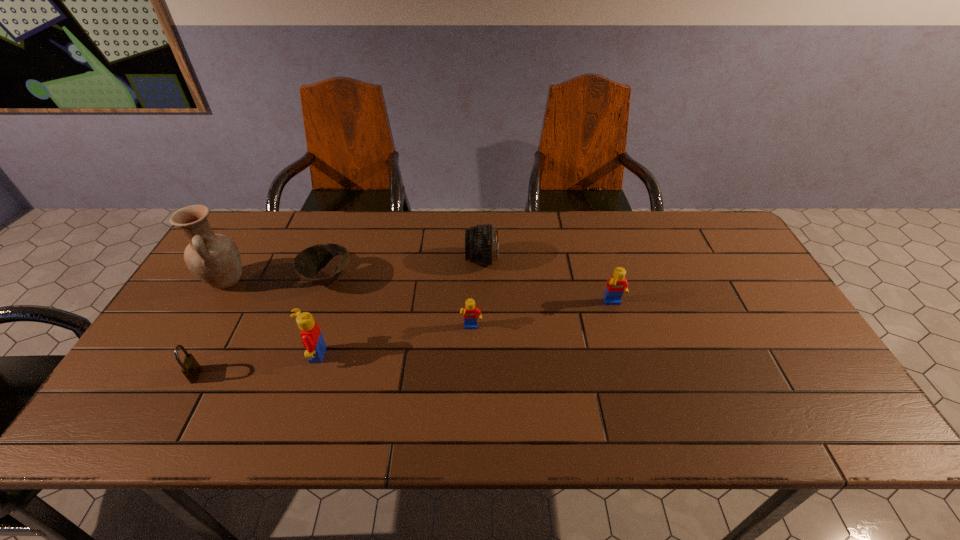
Find the location of a particular element. This screenshot has height=540, width=960. vacant spot to place a Lego on the right is located at coordinates (741, 282).